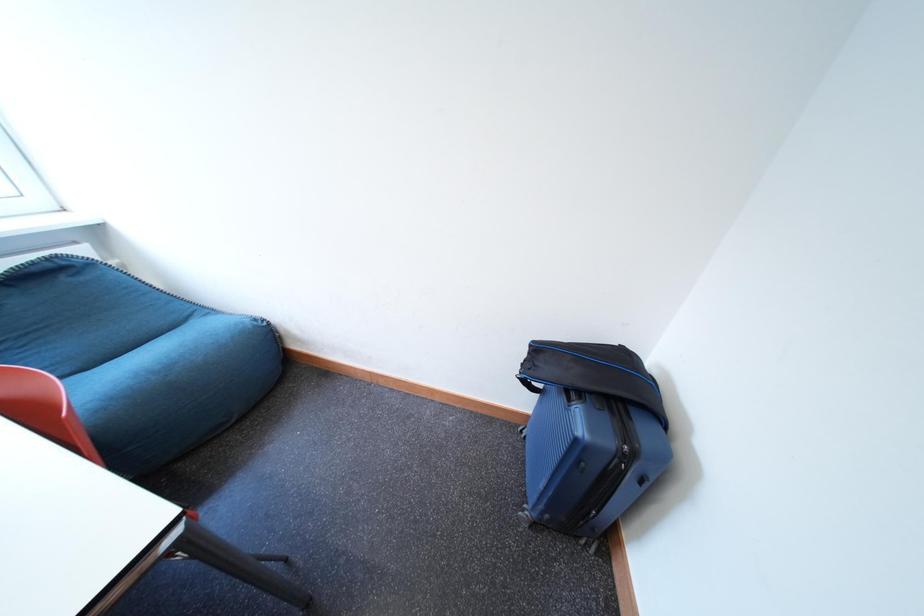
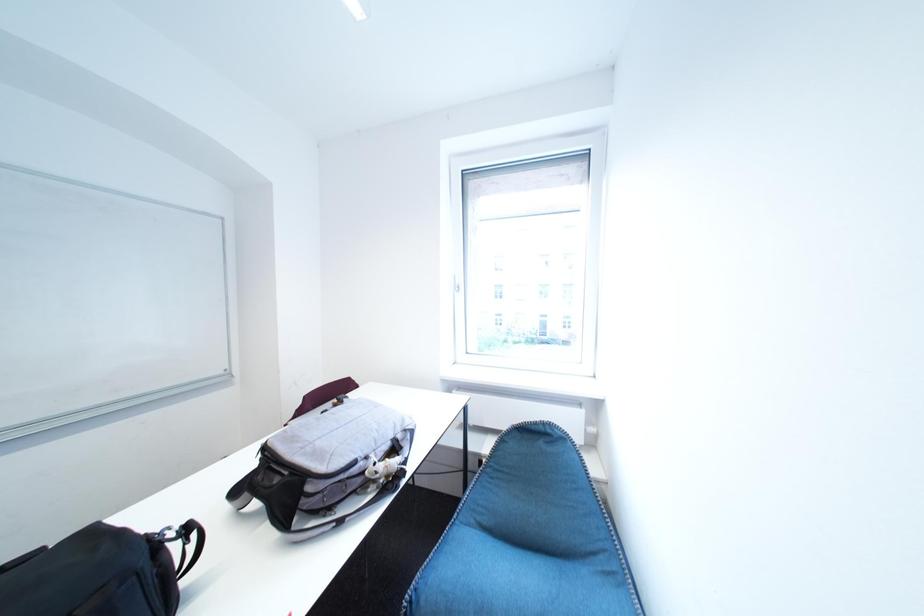
Question: How did the camera likely rotate?

Choices:
 (A) Left
 (B) Right
 (C) Up
 (D) Down

Answer: (A)